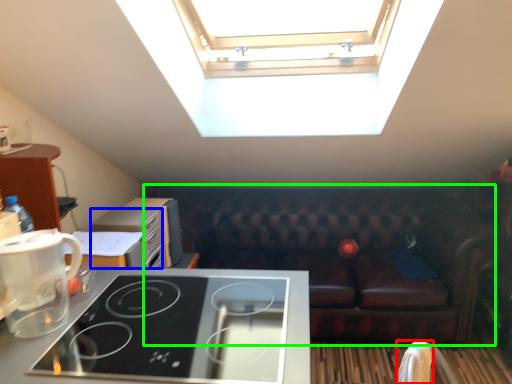
Question: Based on their relative distances, which object is farther from armchair (highlighted by a red box)? Choose from appliance (highlighted by a blue box) and studio couch (highlighted by a green box).

Choices:
 (A) appliance
 (B) studio couch

Answer: (B)